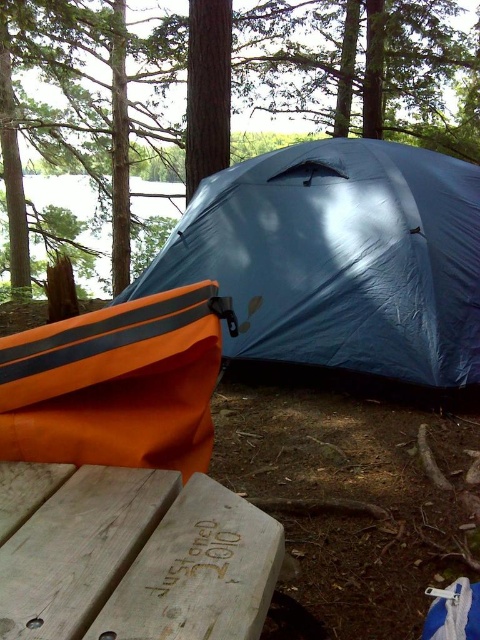
Does wooden picnic table at center have a larger size compared to transparent water at upper left?

No, wooden picnic table at center is not bigger than transparent water at upper left.

Between point (144, 490) and point (133, 189), which one is positioned in front?

Point (144, 490)

Does point (101, 561) come in front of point (154, 204)?

Yes.

This screenshot has width=480, height=640. What are the coordinates of `wooden picnic table at center` in the screenshot? It's located at (131, 556).

Describe the element at coordinates (131, 556) in the screenshot. I see `wooden picnic table at center` at that location.

Is wooden picnic table at center thinner than green matte tree at upper center?

No.

Image resolution: width=480 pixels, height=640 pixels. Describe the element at coordinates (131, 556) in the screenshot. I see `wooden picnic table at center` at that location.

At what (x,y) coordinates should I click in order to perform the action: click on wooden picnic table at center. Please return your answer as a coordinate pair (x, y). This screenshot has width=480, height=640. Looking at the image, I should click on (131, 556).

Is green matte tree at upper center above transparent water at upper left?

Correct, green matte tree at upper center is located above transparent water at upper left.

Between green matte tree at upper center and transparent water at upper left, which one has less height?

green matte tree at upper center is shorter.

Is point (156, 211) closer to camera compared to point (144, 216)?

That is True.

Find the location of a particular element. green matte tree at upper center is located at coordinates (61, 193).